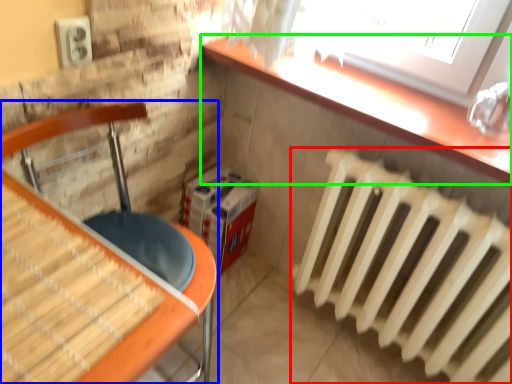
Question: Estimate the real-world distances between objects in this image. Which object is farther from radiator (highlighted by a red box), furniture (highlighted by a blue box) or counter top (highlighted by a green box)?

Choices:
 (A) furniture
 (B) counter top

Answer: (A)